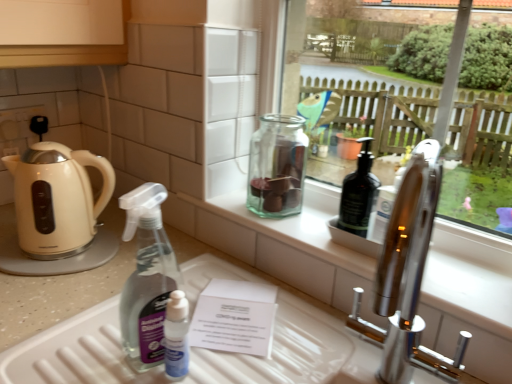
Where is `white plastic tray at lower center`? The width and height of the screenshot is (512, 384). white plastic tray at lower center is located at coordinates (81, 355).

In order to face white plastic tray at lower center, should I rotate leftwards or rightwards?

Turn left by 3.737 degrees to look at white plastic tray at lower center.

The height and width of the screenshot is (384, 512). I want to click on white plastic tray at lower center, so tap(81, 355).

From a real-world perspective, which is physically above, beige glossy kettle at left or green glass jar at center?

From a 3D spatial view, green glass jar at center is above.

Between beige glossy kettle at left and green glass jar at center, which one has larger size?

Bigger between the two is beige glossy kettle at left.

Based on the photo, how far apart are beige glossy kettle at left and green glass jar at center?

beige glossy kettle at left and green glass jar at center are 16.30 inches apart from each other.

Which is closer, (x=32, y=197) or (x=254, y=173)?

Clearly, point (x=32, y=197) is closer to the camera than point (x=254, y=173).

Between beige glossy kettle at left and white plastic tray at lower center, which one has larger width?

With larger width is white plastic tray at lower center.

From the image's perspective, does beige glossy kettle at left appear lower than white plastic tray at lower center?

No.

From the picture: Who is bigger, beige glossy kettle at left or white plastic tray at lower center?

white plastic tray at lower center.

In the scene shown: Is green glass jar at center positioned before white plastic tray at lower center?

No, green glass jar at center is further to the viewer.

Considering the sizes of objects green glass jar at center and white plastic tray at lower center in the image provided, who is thinner, green glass jar at center or white plastic tray at lower center?

green glass jar at center is thinner.

This screenshot has width=512, height=384. Find the location of `bottle on the right of white plastic tray at lower center`. bottle on the right of white plastic tray at lower center is located at coordinates (277, 166).

Is point (258, 173) in front of point (31, 278)?

No, (258, 173) is further to viewer.

Relative to green glass jar at center, is white plastic tray at lower center in front or behind?

white plastic tray at lower center is in front of green glass jar at center.

Is point (310, 308) less distant than point (295, 157)?

Yes, point (310, 308) is in front of point (295, 157).

From the image's perspective, is white plastic tray at lower center on green glass jar at center?

No, from the image's perspective, white plastic tray at lower center is not over green glass jar at center.

Considering the sizes of objects white plastic tray at lower center and green glass jar at center in the image provided, who is taller, white plastic tray at lower center or green glass jar at center?

green glass jar at center is taller.

Considering their positions, is white plastic tray at lower center located in front of or behind beige glossy kettle at left?

Visually, white plastic tray at lower center is located in front of beige glossy kettle at left.

Which of these two, white plastic tray at lower center or beige glossy kettle at left, is thinner?

beige glossy kettle at left.

From a real-world perspective, is white plastic tray at lower center below beige glossy kettle at left?

Indeed, from a real-world perspective, white plastic tray at lower center is positioned beneath beige glossy kettle at left.

Between white plastic tray at lower center and beige glossy kettle at left, which one has less height?

white plastic tray at lower center.

Would you say beige glossy kettle at left is part of green glass jar at center's contents?

No, beige glossy kettle at left is located outside of green glass jar at center.

Is green glass jar at center at the left side of beige glossy kettle at left?

No.

This screenshot has width=512, height=384. Identify the location of bottle lying above the beige glossy kettle at left (from the image's perspective). (277, 166).

From the image's perspective, is green glass jar at center under beige glossy kettle at left?

No.

Where is `kettle on the left of green glass jar at center`? This screenshot has width=512, height=384. kettle on the left of green glass jar at center is located at coordinates (57, 199).

The image size is (512, 384). I want to click on kettle positioned vertically above the white plastic tray at lower center (from a real-world perspective), so click(57, 199).

Based on their spatial positions, is white plastic tray at lower center or green glass jar at center further from beige glossy kettle at left?

The object further to beige glossy kettle at left is green glass jar at center.

Considering their positions, is white plastic tray at lower center positioned closer to green glass jar at center than beige glossy kettle at left?

white plastic tray at lower center lies closer to green glass jar at center than the other object.

Which object lies nearer to the anchor point green glass jar at center, beige glossy kettle at left or white plastic tray at lower center?

white plastic tray at lower center is positioned closer to the anchor green glass jar at center.

Which object lies further to the anchor point beige glossy kettle at left, green glass jar at center or white plastic tray at lower center?

green glass jar at center is positioned further to the anchor beige glossy kettle at left.

In the scene shown: Which object lies further to the anchor point white plastic tray at lower center, green glass jar at center or beige glossy kettle at left?

beige glossy kettle at left is positioned further to the anchor white plastic tray at lower center.

Which object lies further to the anchor point white plastic tray at lower center, beige glossy kettle at left or green glass jar at center?

beige glossy kettle at left lies further to white plastic tray at lower center than the other object.

Find the location of a particular element. kettle between white plastic tray at lower center and green glass jar at center along the z-axis is located at coordinates (57, 199).